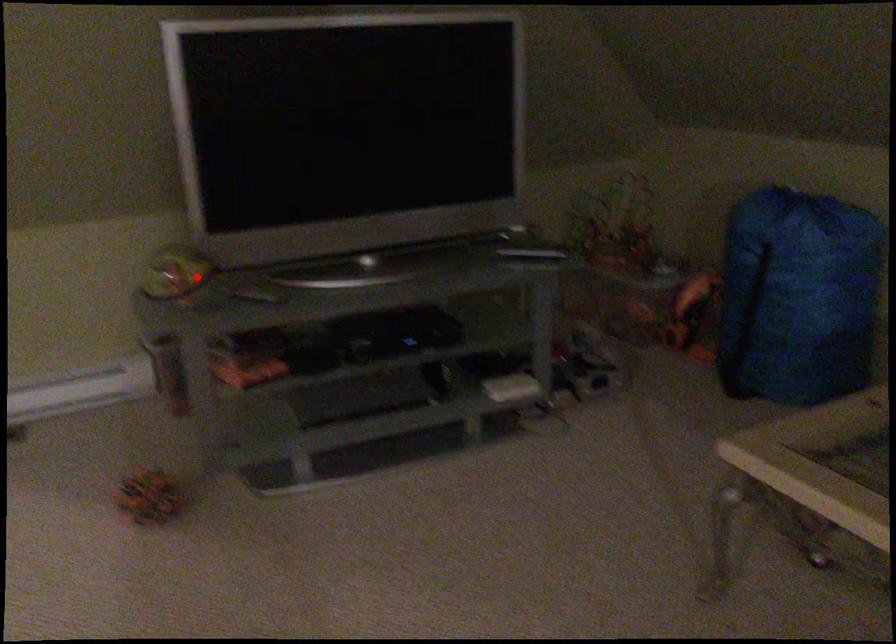
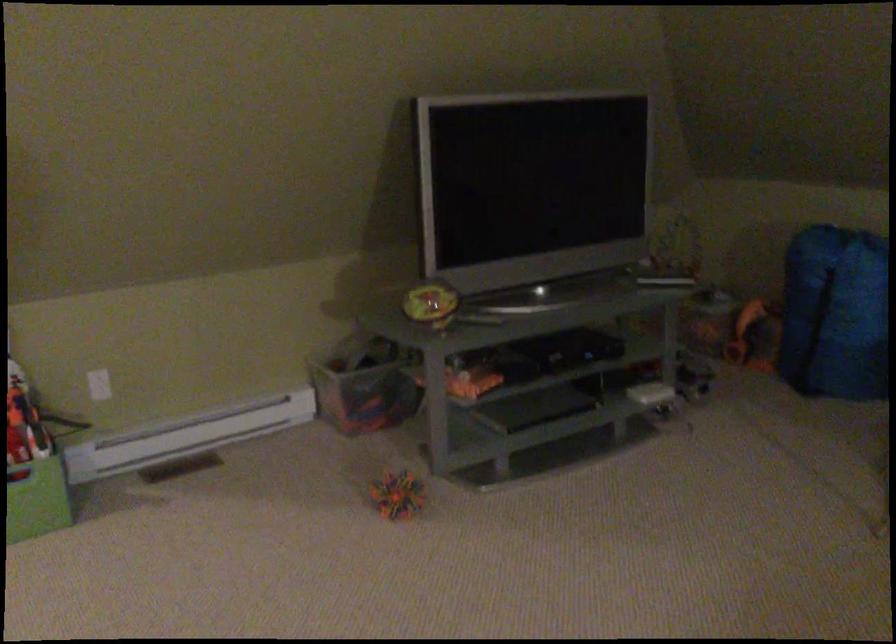
Question: I am providing you with two images of the same scene from different viewpoints. Given a red point in image1, look at the same physical point in image2. Is it:

Choices:
 (A) Closer to the viewpoint
 (B) Farther from the viewpoint

Answer: (B)